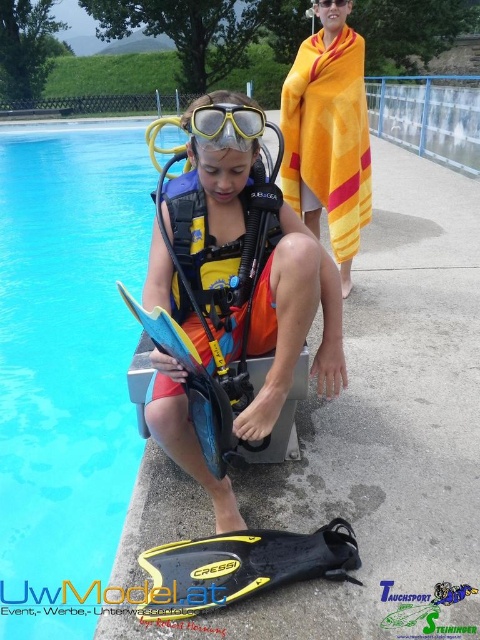
Between yellow matte life vest at center and yellow towel at upper center, which one has more height?

With more height is yellow matte life vest at center.

Is point (159, 289) behind point (325, 68)?

No, it is in front of (325, 68).

The height and width of the screenshot is (640, 480). What are the coordinates of `yellow matte life vest at center` in the screenshot? It's located at (291, 321).

Describe the element at coordinates (328, 132) in the screenshot. The width and height of the screenshot is (480, 640). I see `yellow towel at upper center` at that location.

Is yellow towel at upper center to the left of yellow matte scuba mask at upper center from the viewer's perspective?

In fact, yellow towel at upper center is to the right of yellow matte scuba mask at upper center.

What do you see at coordinates (328, 132) in the screenshot? The height and width of the screenshot is (640, 480). I see `yellow towel at upper center` at bounding box center [328, 132].

Where is `yellow towel at upper center`? yellow towel at upper center is located at coordinates (328, 132).

Based on the photo, can you confirm if yellow matte life vest at center is wider than yellow/orange fabric life jacket at center?

Yes.

In order to click on yellow matte life vest at center in this screenshot , I will do `click(291, 321)`.

You are a GUI agent. You are given a task and a screenshot of the screen. Output one action in this format:
    pyautogui.click(x=<x>, y=<y>)
    Task: Click on the yellow matte life vest at center
    
    Given the screenshot: What is the action you would take?
    pyautogui.click(x=291, y=321)

Image resolution: width=480 pixels, height=640 pixels. Find the location of `yellow matte life vest at center`. yellow matte life vest at center is located at coordinates (291, 321).